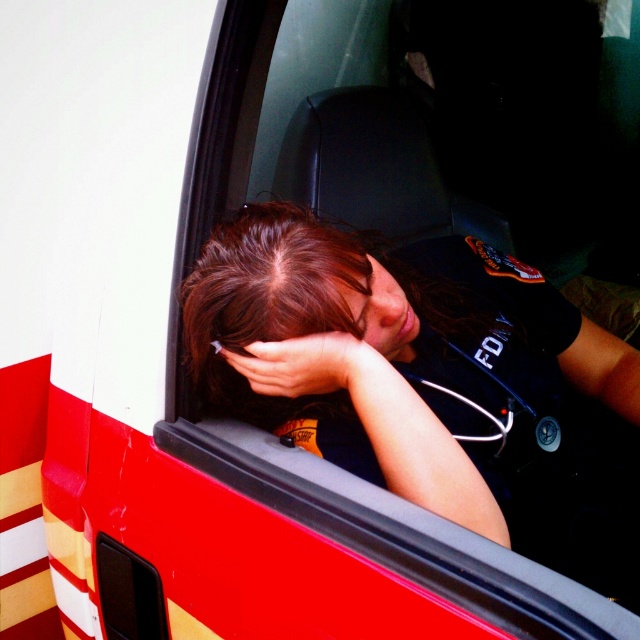
You are a firefighter in a dark blue uniform at center and you see a smooth skin face at center in the mirror of the fire truck window. Which object is closer to the left edge of the window?

The smooth skin face at center is closer to the left edge of the window because the dark blue uniform at center is positioned on the right side of it.

In the scene shown: Looking at the image of the firefighter on the fire truck, which object is closer to the viewer between the dark brown hair at center and the smooth skin face at center?

The dark brown hair at center is closer to the viewer because it is positioned in front of the smooth skin face at center.